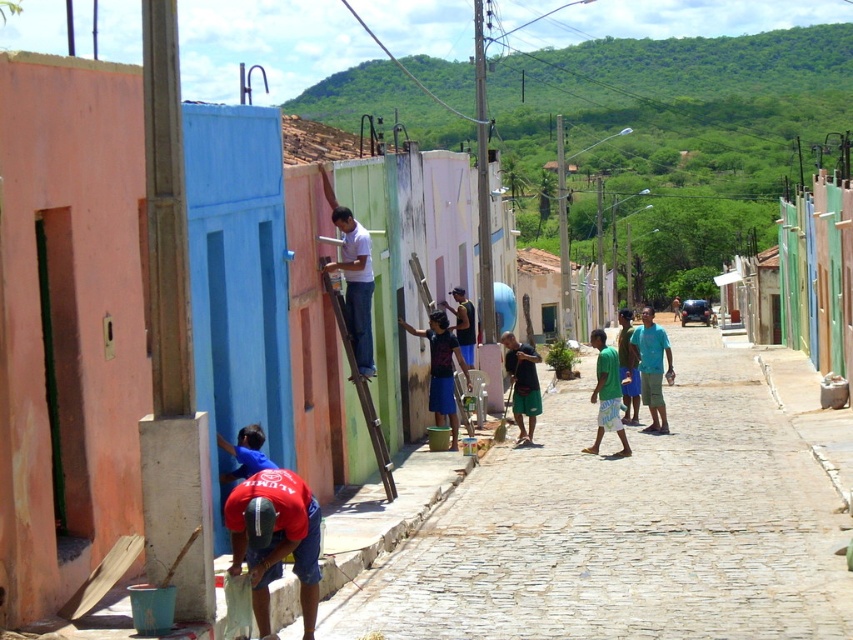
You are a visitor walking down the cobblestone street and see the wooden at center and the green cotton shirt at center. Which object is closer to you?

The wooden at center is closer to you because it is in front of the green cotton shirt at center.

You are a photographer standing at the edge of the cobblestone street. You notice two items of clothing at the center of the scene. Which one is taller between the blue denim shorts at center and the green cotton shirt at center?

The blue denim shorts at center is much taller than the green cotton shirt at center.

You are a photographer planning to take a group photo of the two people in the scene. The red fabric shirt at lower center and the light blue fabric shirt at center. You want to ensure that both shirts are clearly visible in the photo. Which shirt should you focus on to ensure its details are sharp, considering their sizes?

The red fabric shirt at lower center is wider than the light blue fabric shirt at center. Therefore, focusing on the red fabric shirt at lower center would ensure its details are sharp since it occupies more space in the frame.